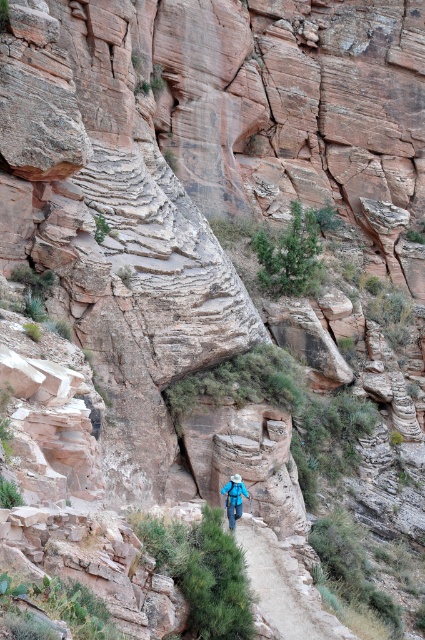
You are standing on the path and want to move towards the cliff face. Which point, point (300, 611) or point (232, 488), is closer to you as you face the cliff?

Point (300, 611) is closer to the viewer than point (232, 488), so it is the closer point when facing the cliff.

You are standing on the dirt path at center and want to place your blue fabric backpack at center so it won

The dirt path at center is to the right of the blue fabric backpack at center, so placing the backpack to the left of the path would keep it out of the way.